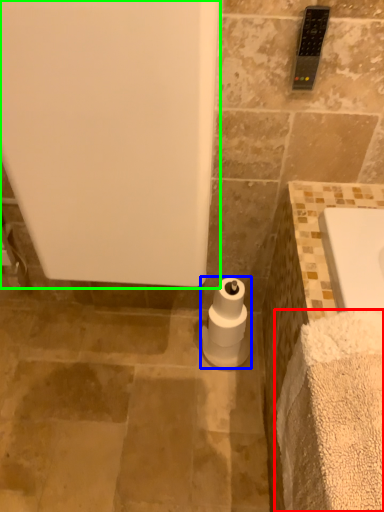
Question: Estimate the real-world distances between objects in this image. Which object is closer to bath towel (highlighted by a red box), toilet paper (highlighted by a blue box) or bath (highlighted by a green box)?

Choices:
 (A) toilet paper
 (B) bath

Answer: (B)